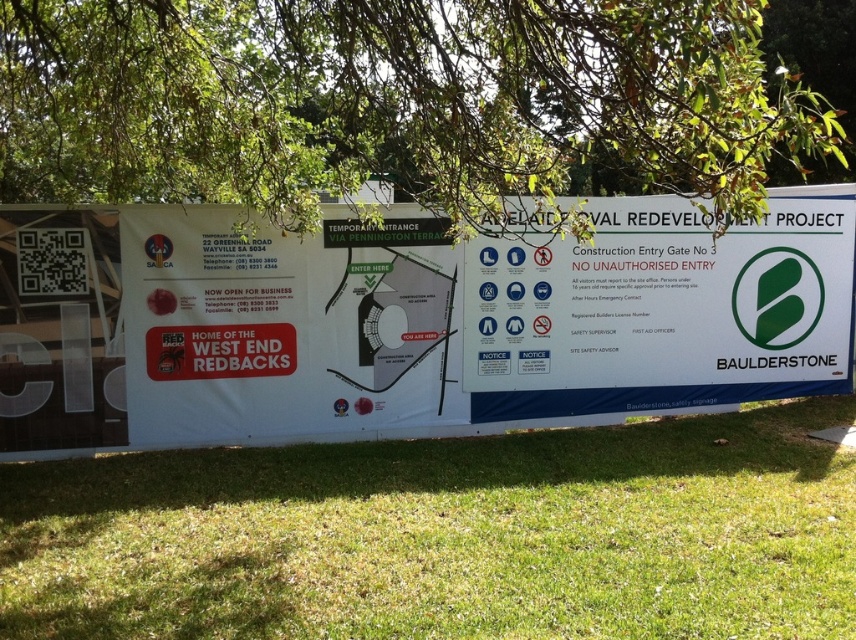
You are standing at point A located at point (676, 586). You need to walk to point B which is 4.83 meters away. Can you estimate how far you need to walk in meters?

You need to walk 4.83 meters to reach point B from point A located at point (676, 586).

You are a drone operator flying a drone that requires a clear space of at least 3 meters in width to land safely. You observe the green grass at lower center and the green leafy tree at upper center in the scene. Which area would provide a safer landing zone based on their widths?

The green grass at lower center might be wider than green leafy tree at upper center, so the green grass at lower center would provide a safer landing zone as it is likely wider than the required 3 meters.